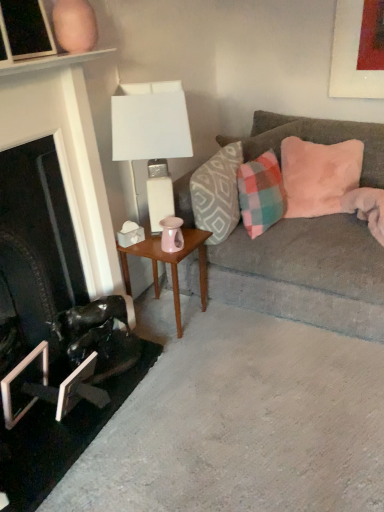
Question: Is point (41, 45) closer or farther from the camera than point (279, 189)?

Choices:
 (A) farther
 (B) closer

Answer: (B)

Question: Is matte black picture frame at upper left, which is the third picture frame in bottom-to-top order, in front of or behind plaid fabric pillow at right, the 2th pillow positioned from the left, in the image?

Choices:
 (A) behind
 (B) front

Answer: (B)

Question: Which of these objects is positioned farthest from the plaid fabric pillow at right, the 2th pillow positioned from the left?

Choices:
 (A) white ceramic table lamp at upper center
 (B) matte black picture frame at upper left, which is the third picture frame in bottom-to-top order
 (C) pink plush pillow at upper right, arranged as the third pillow when viewed from the left
 (D) patterned fabric pillow at center, acting as the 3th pillow starting from the right
 (E) metallic silver picture frame at lower left, which ranks as the 3th picture frame in top-to-bottom order

Answer: (B)

Question: Which object is the farthest from the white ceramic table lamp at upper center?

Choices:
 (A) matte black picture frame at upper left, which is the third picture frame in bottom-to-top order
 (B) velvet gray couch at right
 (C) wooden side table at center
 (D) patterned fabric pillow at center, acting as the 3th pillow starting from the right
 (E) metallic silver picture frame at lower left, which is the 2th picture frame in bottom-to-top order

Answer: (E)